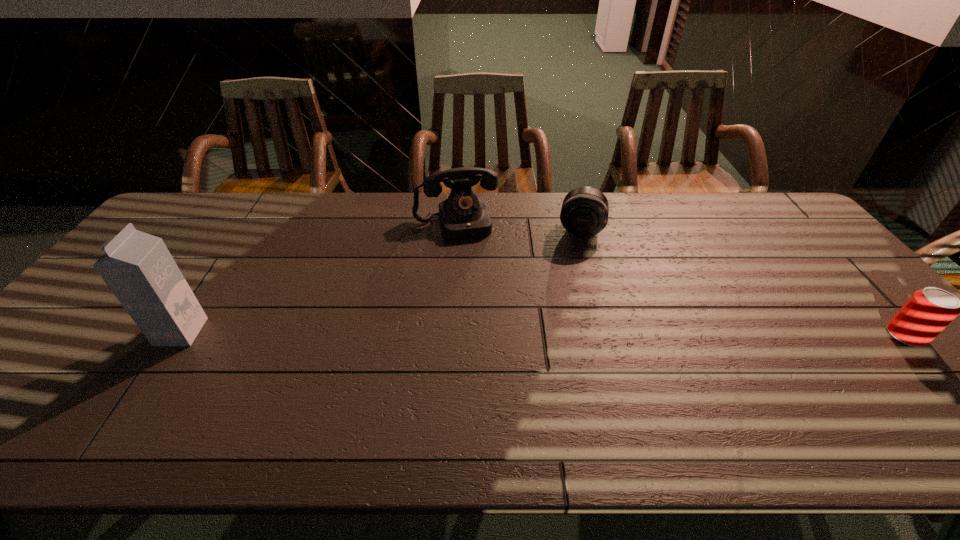
The height and width of the screenshot is (540, 960). Identify the location of free spot between the second object from left to right and the second object from right to left. (518, 226).

Find the location of a particular element. Image resolution: width=960 pixels, height=540 pixels. free spot between the third object from right to left and the leftmost object is located at coordinates (319, 277).

Find the location of a particular element. This screenshot has height=540, width=960. vacant area that lies between the rightmost object and the leftmost object is located at coordinates (543, 334).

You are a GUI agent. You are given a task and a screenshot of the screen. Output one action in this format:
    pyautogui.click(x=<x>, y=<y>)
    Task: Click on the object that ranks as the second closest to the tallest object
    The height and width of the screenshot is (540, 960).
    Given the screenshot: What is the action you would take?
    584,213

Locate which object is the second closest to the leftmost object. Please provide its 2D coordinates. Your answer should be formatted as a tuple, i.e. [(x, y)], where the tuple contains the x and y coordinates of a point satisfying the conditions above.

[(584, 213)]

I want to click on vacant space that satisfies the following two spatial constraints: 1. on the front side of the telephone; 2. on the left side of the beer can, so click(447, 335).

Identify the location of free space that satisfies the following two spatial constraints: 1. on the front side of the second object from right to left; 2. on the left side of the second object from left to right. (455, 229).